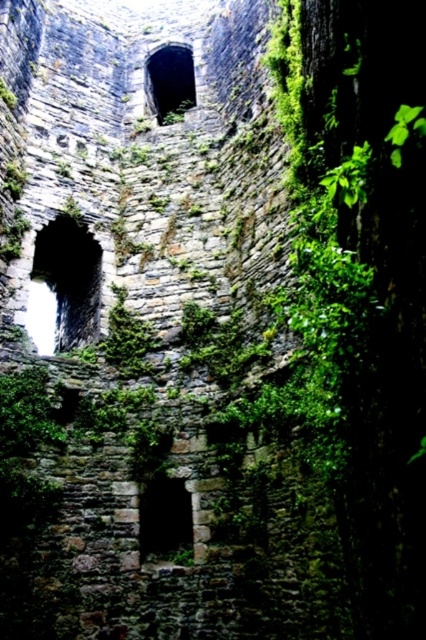
Is dark stone window at left positioned behind dark stone window at center?

Yes, dark stone window at left is behind dark stone window at center.

Image resolution: width=426 pixels, height=640 pixels. I want to click on dark stone window at left, so click(63, 285).

Image resolution: width=426 pixels, height=640 pixels. What do you see at coordinates (63, 285) in the screenshot?
I see `dark stone window at left` at bounding box center [63, 285].

Between dark stone window at left and green mossy stone window at upper center, which one is positioned lower?

dark stone window at left is lower down.

Is point (77, 310) farther from viewer compared to point (192, 100)?

No, (77, 310) is in front of (192, 100).

At what (x,y) coordinates should I click in order to perform the action: click on dark stone window at left. Please return your answer as a coordinate pair (x, y). Looking at the image, I should click on (63, 285).

Who is shorter, dark stone window at center or green mossy stone window at upper center?

dark stone window at center

Does dark stone window at center have a larger size compared to green mossy stone window at upper center?

Actually, dark stone window at center might be smaller than green mossy stone window at upper center.

Measure the distance between dark stone window at center and camera.

dark stone window at center and camera are 52.62 meters apart from each other.

Identify the location of dark stone window at center. (164, 520).